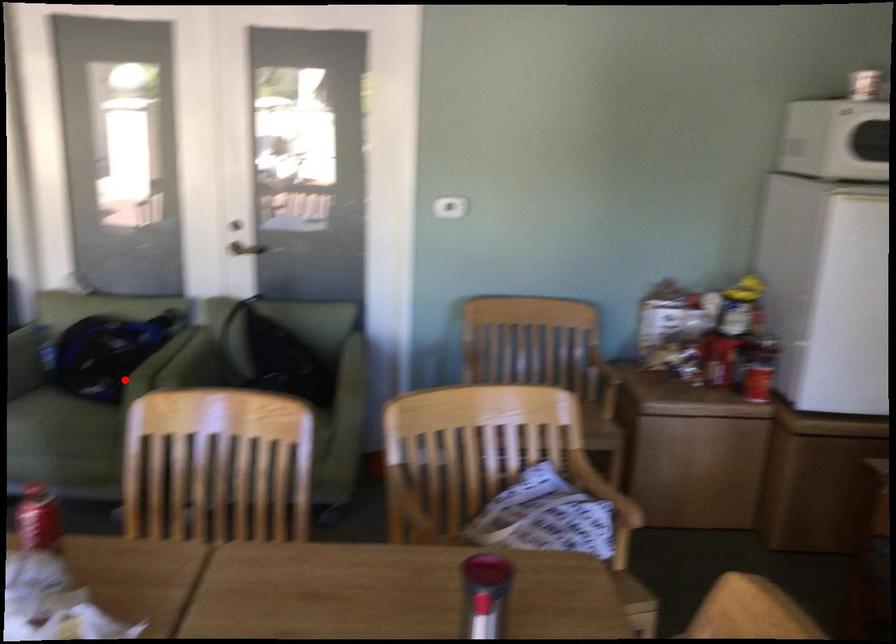
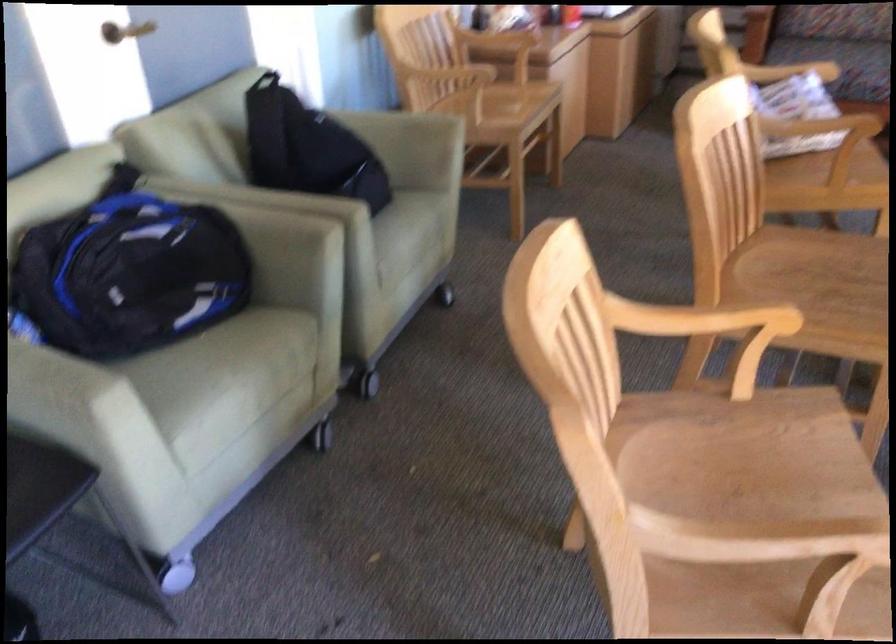
Question: I am providing you with two images of the same scene from different viewpoints. In image1, a red point is highlighted. Considering the same 3D point in image2, which of the following is correct?

Choices:
 (A) It is closer
 (B) It is farther

Answer: (A)